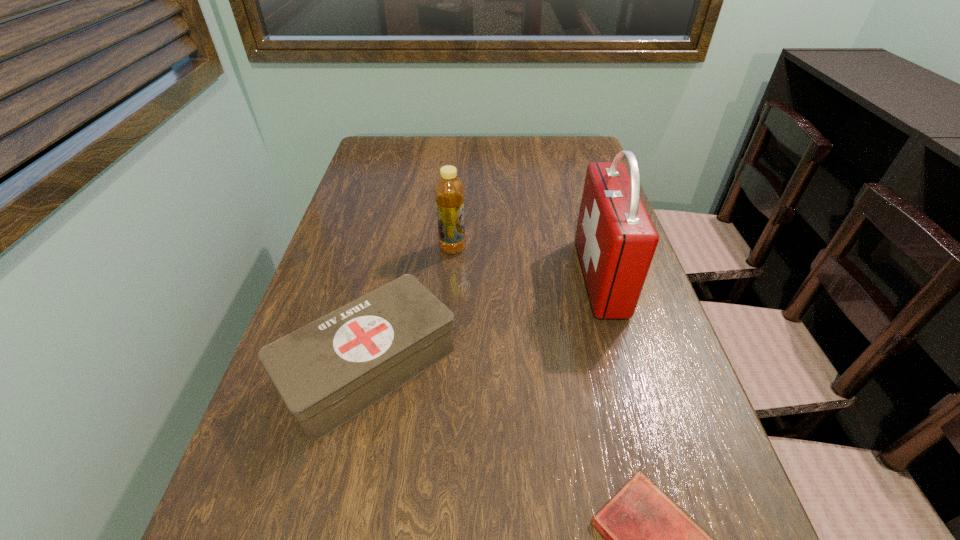
Where is `the right first-aid kit`? This screenshot has height=540, width=960. the right first-aid kit is located at coordinates (616, 240).

Identify the location of the taller first-aid kit. The image size is (960, 540). [616, 240].

What are the coordinates of `the third shortest object` in the screenshot? It's located at (449, 192).

The width and height of the screenshot is (960, 540). What are the coordinates of `the left first-aid kit` in the screenshot? It's located at (328, 371).

Locate an element on the screen. The height and width of the screenshot is (540, 960). the shorter first-aid kit is located at coordinates (328, 371).

Find the location of a particular element. The image size is (960, 540). free space located 0.060m on the front face of the taller first-aid kit is located at coordinates [x=556, y=277].

At what (x,y) coordinates should I click in order to perform the action: click on vacant point located 0.090m on the front face of the taller first-aid kit. Please return your answer as a coordinate pair (x, y). This screenshot has height=540, width=960. Looking at the image, I should click on (543, 277).

I want to click on blank space located on the front face of the taller first-aid kit, so click(x=434, y=277).

Image resolution: width=960 pixels, height=540 pixels. What are the coordinates of `blank space located on the back of the bottle` in the screenshot? It's located at (455, 206).

The width and height of the screenshot is (960, 540). What are the coordinates of `free space located on the right of the third tallest object` in the screenshot? It's located at (524, 367).